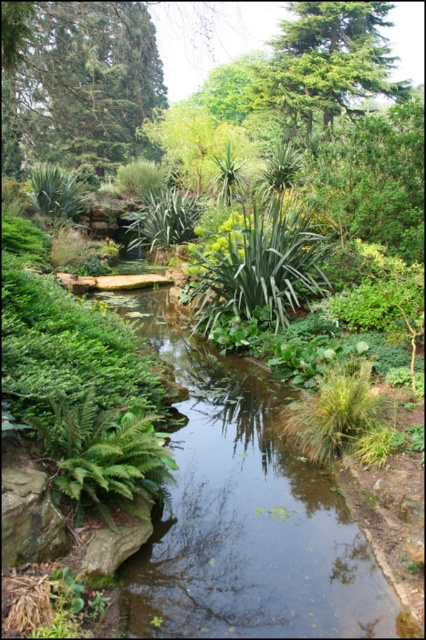
Question: Which point is farther to the camera?

Choices:
 (A) green leafy fern at center
 (B) green leafy stream at center

Answer: (A)

Question: Which object appears farthest from the camera in this image?

Choices:
 (A) green needle-like at upper right
 (B) green leafy fern at center
 (C) green textured tree at upper left
 (D) green matte fern at lower left

Answer: (A)

Question: Is green needle-like at upper right further to the viewer compared to green leafy fern at center?

Choices:
 (A) no
 (B) yes

Answer: (B)

Question: Is green textured tree at upper left bigger than green matte fern at lower left?

Choices:
 (A) no
 (B) yes

Answer: (B)

Question: Which of these objects is positioned closest to the green needle-like at upper right?

Choices:
 (A) green leafy stream at center
 (B) green textured tree at upper left
 (C) green matte fern at lower left

Answer: (B)

Question: Can you confirm if green needle-like at upper right is positioned to the right of green leafy fern at center?

Choices:
 (A) yes
 (B) no

Answer: (A)